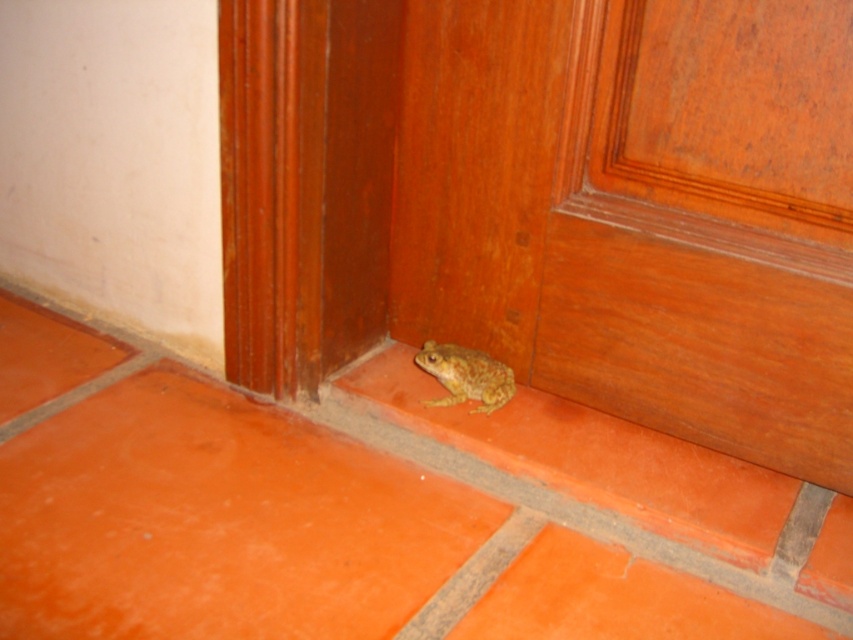
You are a delivery robot with a width of 12 inches. You need to pass through the wooden door at lower right to deliver a package. However, there is a camouflage skin frog at lower right in your path. Can you safely navigate around the frog without hitting it?

The wooden door at lower right is 12.43 inches from the camouflage skin frog at lower right. Since the robot is 12 inches wide, there is enough space to navigate around the frog as the distance between them allows for a safe passage.